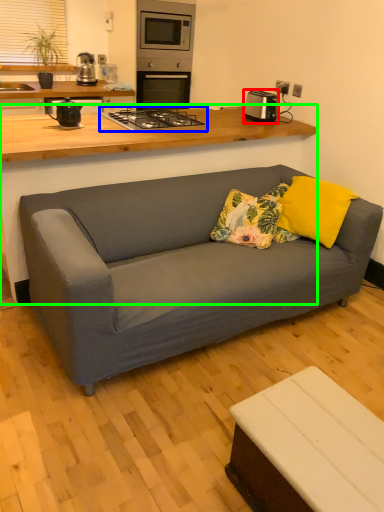
Question: Which object is positioned farthest from appliance (highlighted by a red box)? Select from gas stove (highlighted by a blue box) and table (highlighted by a green box).

Choices:
 (A) gas stove
 (B) table

Answer: (B)